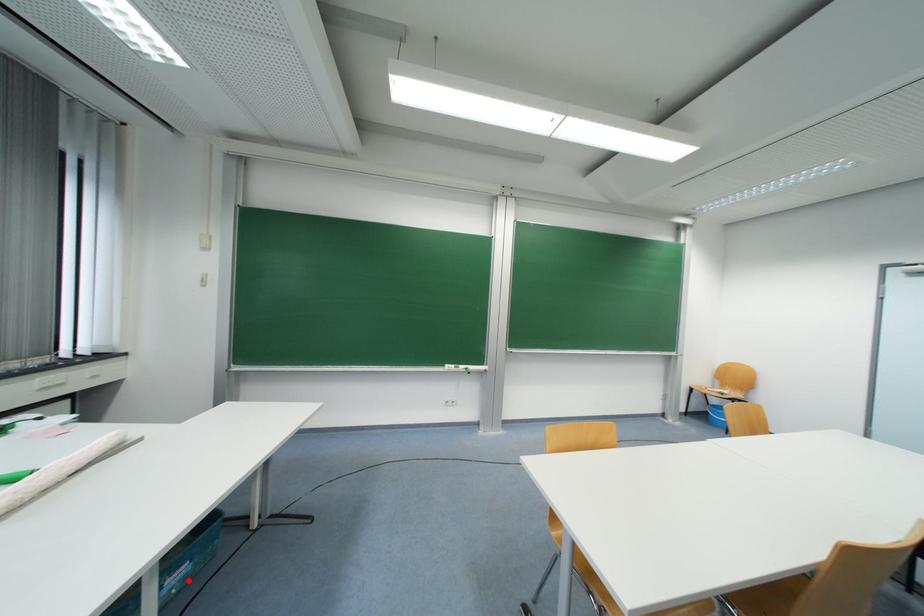
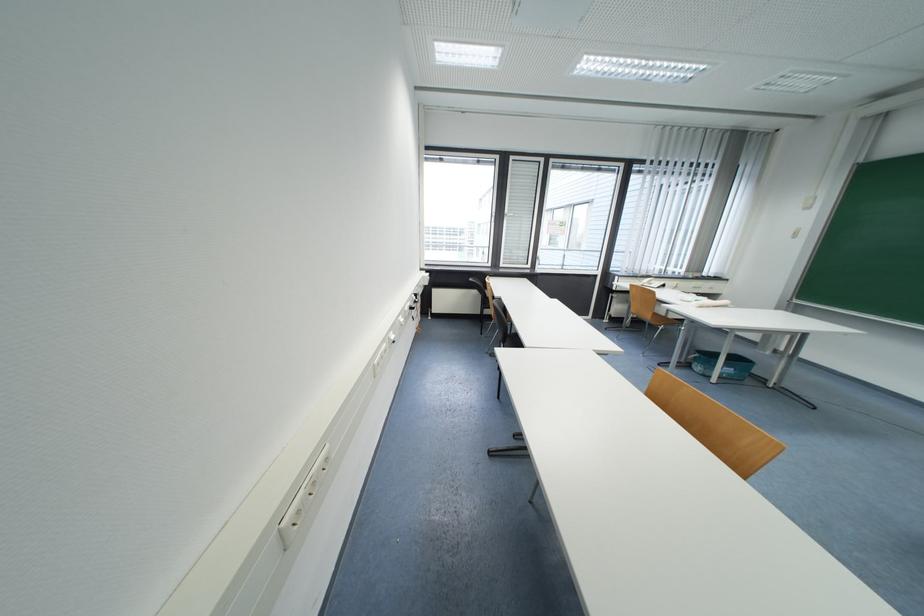
Where in the second image is the point corresponding to the highlighted location from the first image?

(734, 377)